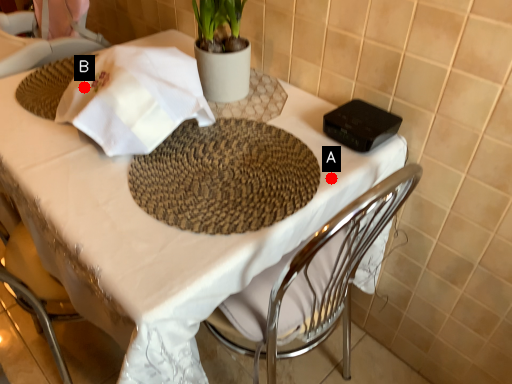
Question: Two points are circled on the image, labeled by A and B beside each circle. Which point is farther to the camera?

Choices:
 (A) A is further
 (B) B is further

Answer: (B)